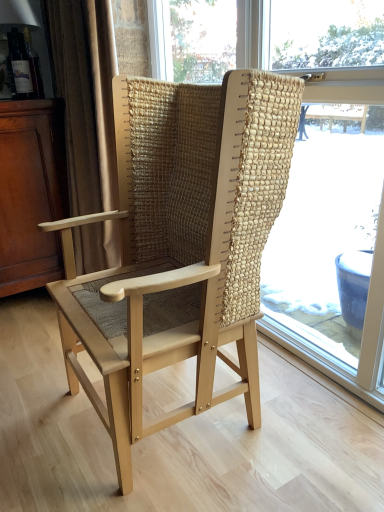
The image size is (384, 512). Find the location of `mahogany wood dresser at left`. mahogany wood dresser at left is located at coordinates (31, 193).

Identify the location of natural woven fabric chair at center. (315, 170).

Considering the positions of objects natural woven fabric chair at center and beige fabric curtain at left in the image provided, who is more to the right, natural woven fabric chair at center or beige fabric curtain at left?

Positioned to the right is natural woven fabric chair at center.

Can beige fabric curtain at left be found inside natural woven fabric chair at center?

Definitely not — beige fabric curtain at left is not inside natural woven fabric chair at center.

You are a GUI agent. You are given a task and a screenshot of the screen. Output one action in this format:
    pyautogui.click(x=<x>, y=<y>)
    Task: Click on the window lying on the right of beige fabric curtain at left
    This screenshot has height=512, width=384.
    Given the screenshot: What is the action you would take?
    click(x=315, y=170)

Where is `chair that is on the right side of mahogany wood dresser at left`? chair that is on the right side of mahogany wood dresser at left is located at coordinates (181, 245).

Is natural wood chair at center to the left or to the right of mahogany wood dresser at left in the image?

Clearly, natural wood chair at center is on the right of mahogany wood dresser at left in the image.

From a real-world perspective, is natural wood chair at center positioned above or below mahogany wood dresser at left?

natural wood chair at center is situated higher than mahogany wood dresser at left in the real world.

How many degrees apart are the facing directions of natural wood chair at center and mahogany wood dresser at left?

The angular difference between natural wood chair at center and mahogany wood dresser at left is 90.5 degrees.

Can you confirm if mahogany wood dresser at left is shorter than natural wood chair at center?

Yes, mahogany wood dresser at left is shorter than natural wood chair at center.

In the scene shown: Can you tell me how much mahogany wood dresser at left and natural wood chair at center differ in facing direction?

mahogany wood dresser at left and natural wood chair at center are facing 90.5 degrees away from each other.

Can natural wood chair at center be found inside mahogany wood dresser at left?

No, mahogany wood dresser at left does not contain natural wood chair at center.

From the image's perspective, which object appears higher, mahogany wood dresser at left or natural wood chair at center?

From the image's view, mahogany wood dresser at left is above.

Considering the relative sizes of natural woven fabric chair at center and mahogany wood dresser at left in the image provided, is natural woven fabric chair at center taller than mahogany wood dresser at left?

Indeed, natural woven fabric chair at center has a greater height compared to mahogany wood dresser at left.

At what (x,y) coordinates should I click in order to perform the action: click on dresser below the natural woven fabric chair at center (from the image's perspective). Please return your answer as a coordinate pair (x, y). Image resolution: width=384 pixels, height=512 pixels. Looking at the image, I should click on (31, 193).

Can you confirm if natural woven fabric chair at center is positioned to the left of mahogany wood dresser at left?

No, natural woven fabric chair at center is not to the left of mahogany wood dresser at left.

Are beige fabric curtain at left and natural wood chair at center far apart?

Actually, beige fabric curtain at left and natural wood chair at center are a little close together.

From the image's perspective, is beige fabric curtain at left below natural wood chair at center?

No, from the image's perspective, beige fabric curtain at left is not beneath natural wood chair at center.

Does beige fabric curtain at left come behind natural wood chair at center?

Yes, beige fabric curtain at left is further from the camera.

In the scene shown: From the image's perspective, is natural woven fabric chair at center located beneath natural wood chair at center?

Actually, natural woven fabric chair at center appears above natural wood chair at center in the image.

From the picture: Is natural woven fabric chair at center looking in the opposite direction of natural wood chair at center?

Absolutely, natural woven fabric chair at center is directed away from natural wood chair at center.

From a real-world perspective, is natural woven fabric chair at center located higher than natural wood chair at center?

Correct, in the physical world, natural woven fabric chair at center is higher than natural wood chair at center.

From a real-world perspective, which object rests below the other?

From a 3D spatial view, mahogany wood dresser at left is below.

Is beige fabric curtain at left taller than mahogany wood dresser at left?

Indeed, beige fabric curtain at left has a greater height compared to mahogany wood dresser at left.

From the image's perspective, relative to mahogany wood dresser at left, is beige fabric curtain at left above or below?

Clearly, from the image's perspective, beige fabric curtain at left is above mahogany wood dresser at left.

How different are the orientations of beige fabric curtain at left and mahogany wood dresser at left in degrees?

The angle between the facing direction of beige fabric curtain at left and the facing direction of mahogany wood dresser at left is 91 degrees.

At what (x,y) coordinates should I click in order to perform the action: click on window located underneath the beige fabric curtain at left (from a real-world perspective). Please return your answer as a coordinate pair (x, y). Looking at the image, I should click on (315, 170).

This screenshot has height=512, width=384. What are the coordinates of `dresser that is above the natural wood chair at center (from the image's perspective)` in the screenshot? It's located at (31, 193).

Considering their positions, is natural woven fabric chair at center positioned closer to natural wood chair at center than beige fabric curtain at left?

Based on the image, beige fabric curtain at left appears to be nearer to natural wood chair at center.

Considering their positions, is mahogany wood dresser at left positioned further to natural wood chair at center than beige fabric curtain at left?

The object further to natural wood chair at center is mahogany wood dresser at left.

Estimate the real-world distances between objects in this image. Which object is further from beige fabric curtain at left, natural wood chair at center or mahogany wood dresser at left?

natural wood chair at center is positioned further to the anchor beige fabric curtain at left.

Consider the image. Considering their positions, is natural woven fabric chair at center positioned further to mahogany wood dresser at left than beige fabric curtain at left?

Based on the image, natural woven fabric chair at center appears to be further to mahogany wood dresser at left.

Based on their spatial positions, is mahogany wood dresser at left or natural woven fabric chair at center closer to natural wood chair at center?

mahogany wood dresser at left is positioned closer to the anchor natural wood chair at center.

Considering their positions, is natural woven fabric chair at center positioned further to mahogany wood dresser at left than natural wood chair at center?

natural woven fabric chair at center is positioned further to the anchor mahogany wood dresser at left.

Considering their positions, is natural wood chair at center positioned closer to beige fabric curtain at left than natural woven fabric chair at center?

The object closer to beige fabric curtain at left is natural wood chair at center.

When comparing their distances from mahogany wood dresser at left, does beige fabric curtain at left or natural wood chair at center seem closer?

Among the two, beige fabric curtain at left is located nearer to mahogany wood dresser at left.

The image size is (384, 512). I want to click on window between natural wood chair at center and beige fabric curtain at left from front to back, so click(x=315, y=170).

I want to click on chair situated between mahogany wood dresser at left and natural woven fabric chair at center from left to right, so click(x=181, y=245).

Where is `curtain between natural wood chair at center and mahogany wood dresser at left along the z-axis`? The width and height of the screenshot is (384, 512). curtain between natural wood chair at center and mahogany wood dresser at left along the z-axis is located at coordinates (86, 99).

The image size is (384, 512). Find the location of `curtain located between mahogany wood dresser at left and natural woven fabric chair at center in the left-right direction`. curtain located between mahogany wood dresser at left and natural woven fabric chair at center in the left-right direction is located at coordinates (86, 99).